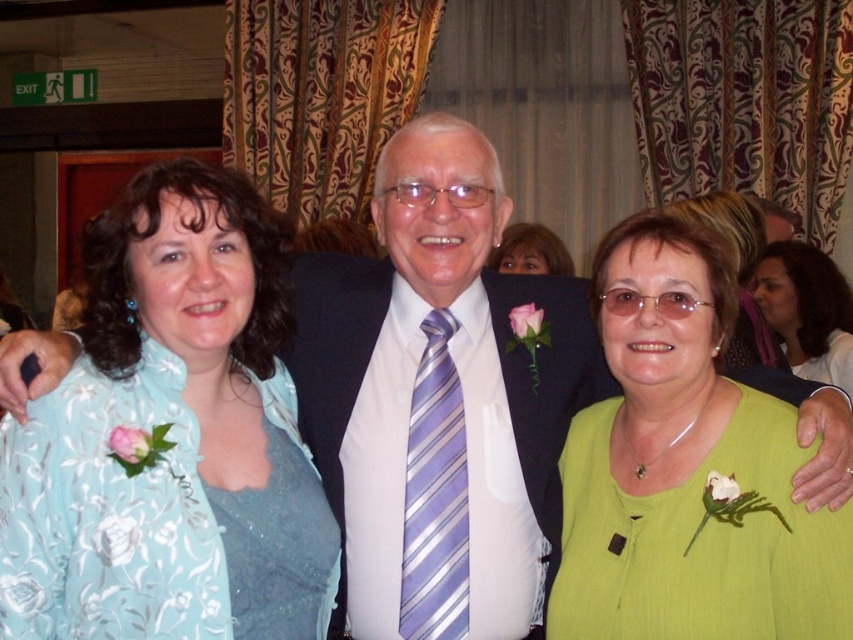
Can you confirm if light blue floral blouse at center is positioned to the right of lavender striped tie at center?

Incorrect, light blue floral blouse at center is not on the right side of lavender striped tie at center.

Does light blue floral blouse at center have a greater width compared to lavender striped tie at center?

Yes, light blue floral blouse at center is wider than lavender striped tie at center.

What do you see at coordinates (215, 387) in the screenshot?
I see `light blue floral blouse at center` at bounding box center [215, 387].

Where is `light blue floral blouse at center`? Image resolution: width=853 pixels, height=640 pixels. light blue floral blouse at center is located at coordinates (215, 387).

Who is positioned more to the left, lavender striped tie at center or matte green dress at lower right?

Positioned to the left is lavender striped tie at center.

Is point (416, 513) positioned in front of point (819, 312)?

Yes, it is.

Image resolution: width=853 pixels, height=640 pixels. What are the coordinates of `lavender striped tie at center` in the screenshot? It's located at (434, 496).

Between green fabric at center and lavender striped tie at center, which one is positioned lower?

lavender striped tie at center is lower down.

Who is positioned more to the right, green fabric at center or lavender striped tie at center?

From the viewer's perspective, green fabric at center appears more on the right side.

Who is more distant from viewer, (630, 490) or (415, 580)?

The point (415, 580) is behind.

Image resolution: width=853 pixels, height=640 pixels. Identify the location of green fabric at center. (686, 468).